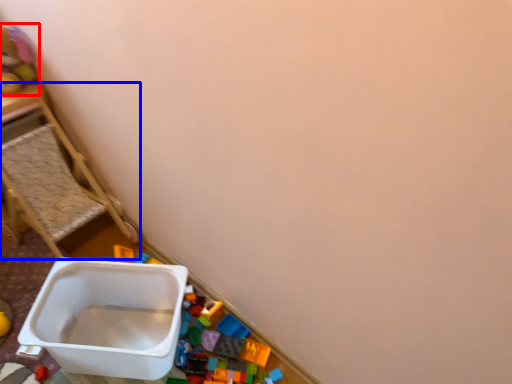
Question: Which object appears closest to the camera in this image, toy (highlighted by a red box) or furniture (highlighted by a blue box)?

Choices:
 (A) toy
 (B) furniture

Answer: (B)